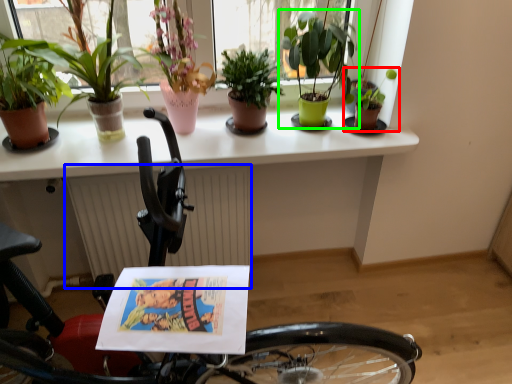
Question: Based on their relative distances, which object is farther from houseplant (highlighted by a red box)? Choose from radiator (highlighted by a blue box) and houseplant (highlighted by a green box).

Choices:
 (A) radiator
 (B) houseplant

Answer: (A)